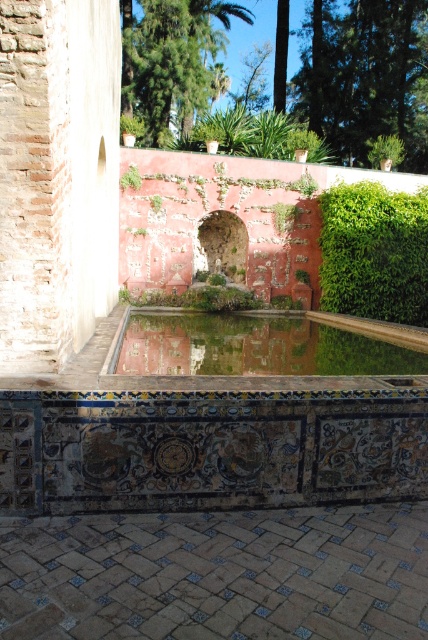
You are standing in the garden and want to take a photo of both the green mossy pool at center and the green leafy palm tree at upper center. Which object should you position to your left to capture both in the frame?

You should position the green leafy palm tree at upper center to your left since the green mossy pool at center is to the right of it.

You are planning to place a small statue in the garden scene. The statue requires a base that must be larger than the green mossy pool at center. Can the green leafy palm tree at upper center serve as this base?

The green leafy palm tree at upper center is larger than the green mossy pool at center, so it can serve as a base for the statue.

You are a gardener who wants to trim the green leafy hedge at right so that it is the same height as the green mossy pool at center. Based on the scene description, how much should you trim the hedge?

The green mossy pool at center is shorter than the green leafy hedge at right, so you should trim the hedge to match the pool height.